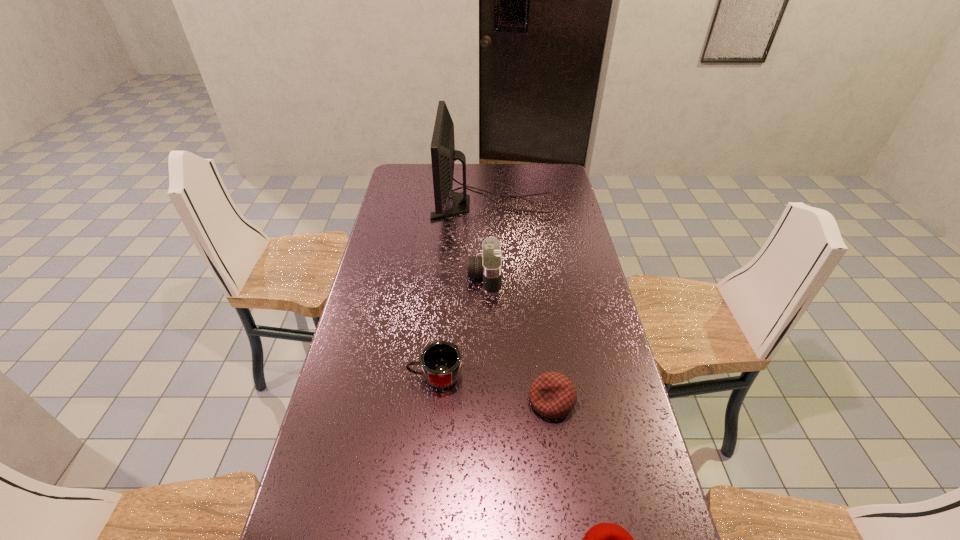
Image resolution: width=960 pixels, height=540 pixels. I want to click on blank space located on the front-facing side of the camera, so click(x=418, y=276).

Locate an element on the screen. The height and width of the screenshot is (540, 960). free space located on the front-facing side of the camera is located at coordinates (368, 276).

Locate an element on the screen. The image size is (960, 540). free location located on the side of the third shortest object with the handle is located at coordinates (342, 377).

Find the location of a particular element. Image resolution: width=960 pixels, height=540 pixels. vacant position located on the side of the third shortest object with the handle is located at coordinates (370, 377).

The image size is (960, 540). I want to click on vacant region located on the side of the third shortest object with the handle, so click(x=370, y=377).

This screenshot has height=540, width=960. I want to click on vacant space located on the left of the farther beanbag, so click(x=448, y=401).

Locate an element on the screen. This screenshot has width=960, height=540. object at the far edge is located at coordinates (443, 154).

Identify the location of computer monitor that is positioned at the right edge. This screenshot has width=960, height=540. (443, 154).

Image resolution: width=960 pixels, height=540 pixels. In order to click on beanbag that is at the right edge in this screenshot , I will do `click(553, 395)`.

Identify the location of object at the far right corner. pos(443,154).